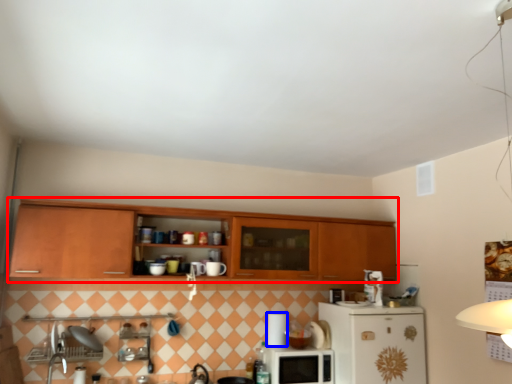
Question: Which of the following is the closest to the observer, cabinetry (highlighted by a red box) or appliance (highlighted by a blue box)?

Choices:
 (A) cabinetry
 (B) appliance

Answer: (A)